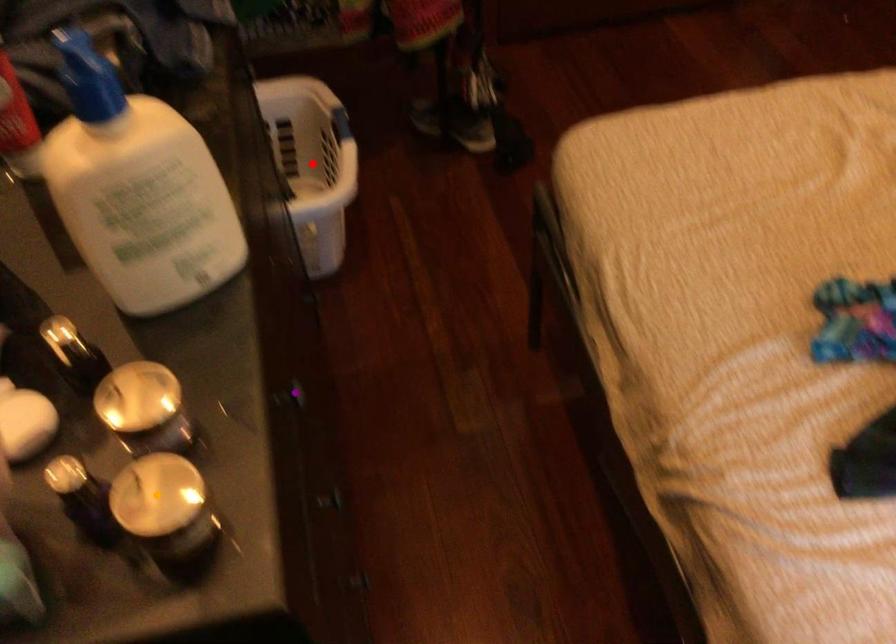
In the scene shown: Order these from nearest to farthest:
orange point, purple point, red point

1. red point
2. purple point
3. orange point